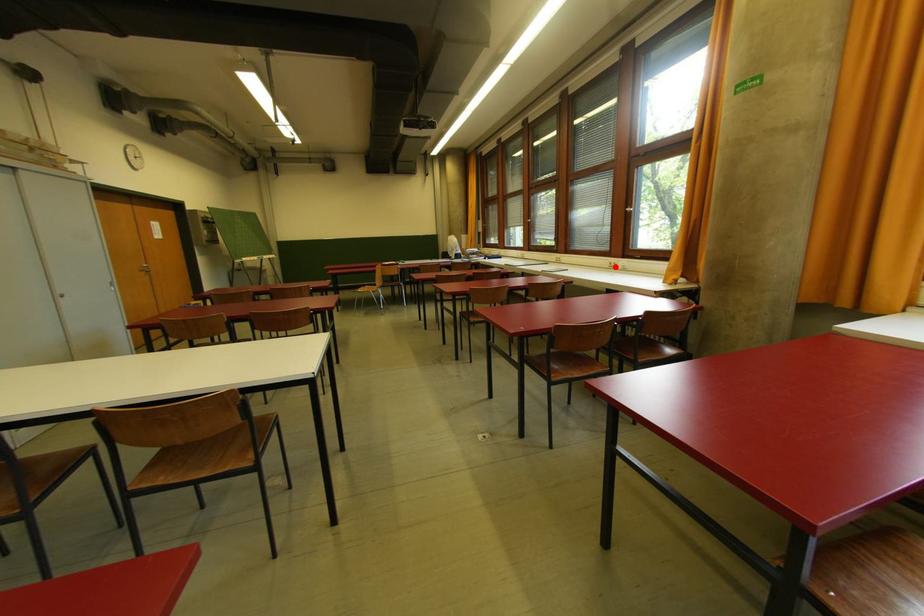
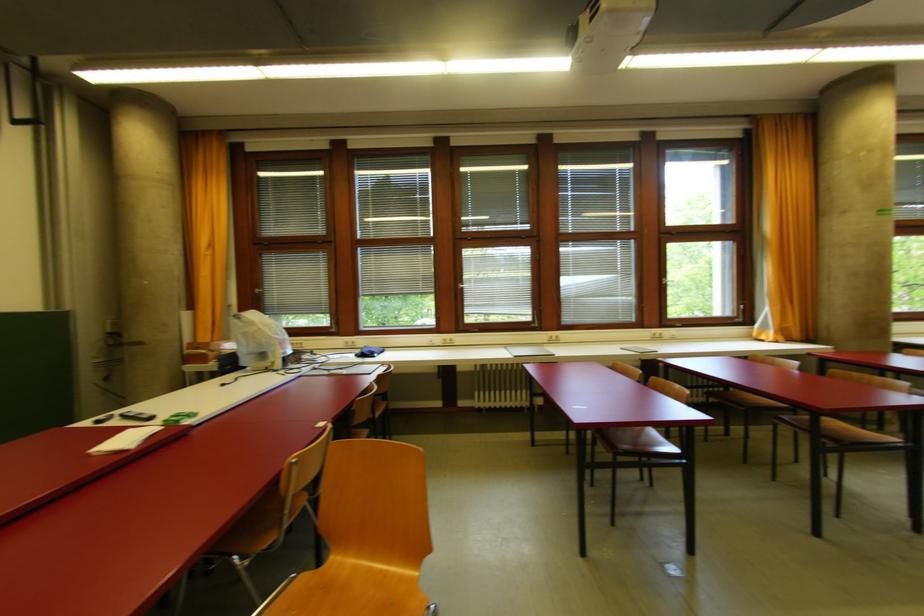
Question: I am providing you with two images of the same scene from different viewpoints. Image1 has a red point marked. In image2, the corresponding 3D location appears at what relative position? Reply with the corresponding letter.

Choices:
 (A) Closer
 (B) Farther

Answer: (B)